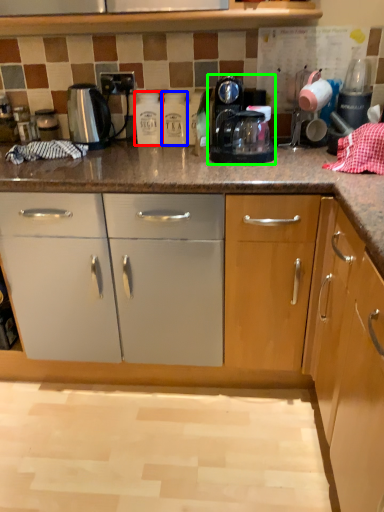
Question: Estimate the real-world distances between objects in this image. Which object is closer to bottle (highlighted by a red box), bottle (highlighted by a blue box) or home appliance (highlighted by a green box)?

Choices:
 (A) bottle
 (B) home appliance

Answer: (A)